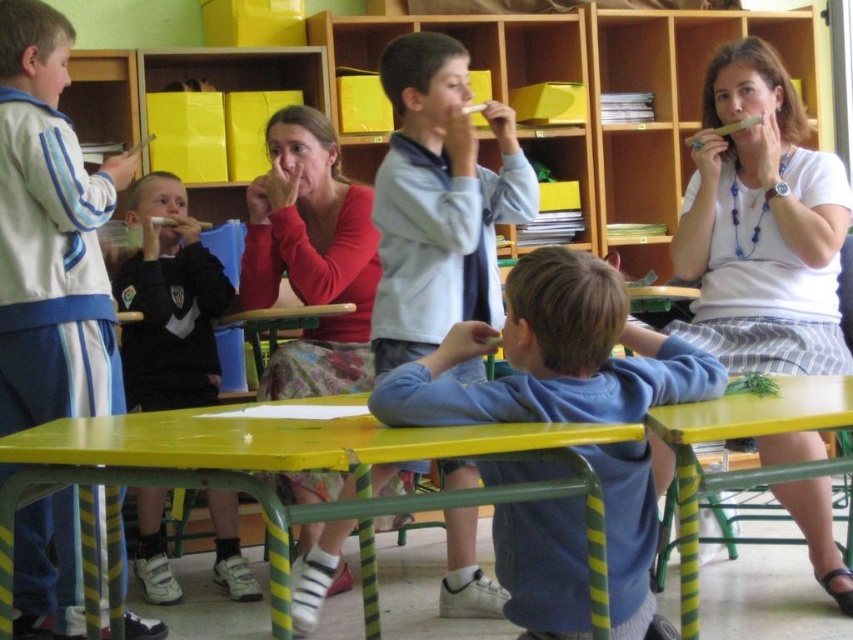
You are a student in the classroom and want to place your blue fleece sweater at center on the yellow painted wood table at lower center. Can you place it directly to the left side of the table?

The blue fleece sweater at center is already positioned to the right of the yellow painted wood table at lower center, so placing it directly to the left side of the table would require moving it from its current position.

You are a student in the classroom and need to place your red sweater on the table. Based on the sizes of the yellow painted wood table at lower center and the matte red sweater at center, will the sweater fit on the table?

The yellow painted wood table at lower center is bigger than the matte red sweater at center, so the sweater will fit on the table.